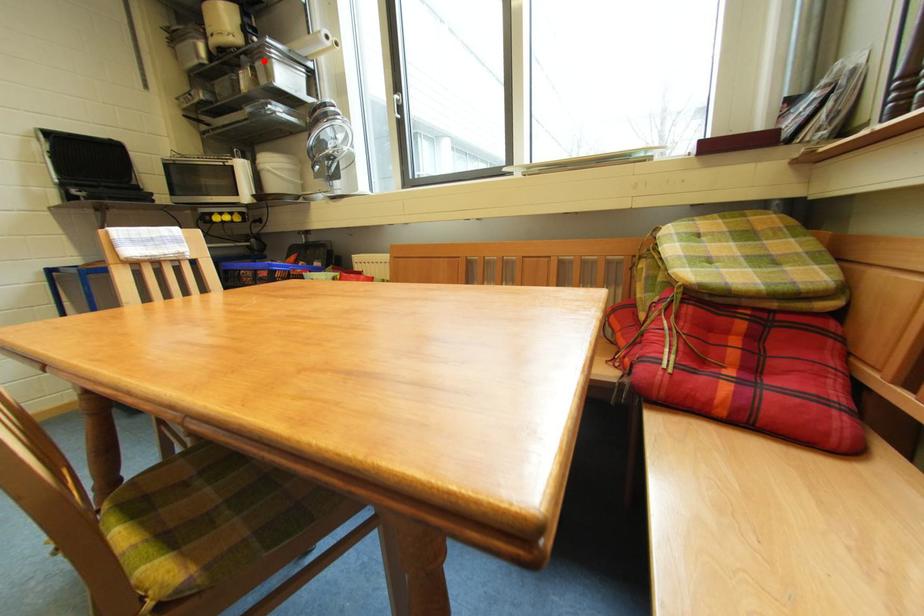
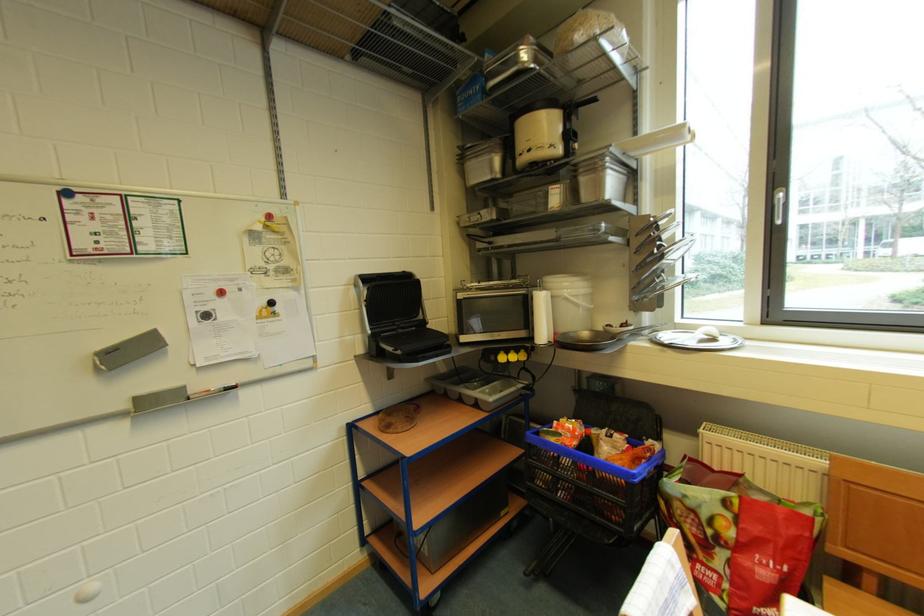
Question: I am providing you with two images of the same scene from different viewpoints. A red point is marked on the first image. At the location where the point appears in image 1, is it still visible in image 2?

Choices:
 (A) Yes
 (B) No

Answer: (A)